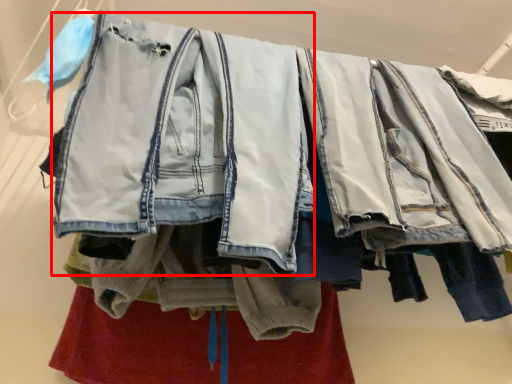
Question: In this image, where is denim jacket (annotated by the red box) located relative to underclothes?

Choices:
 (A) right
 (B) left

Answer: (B)